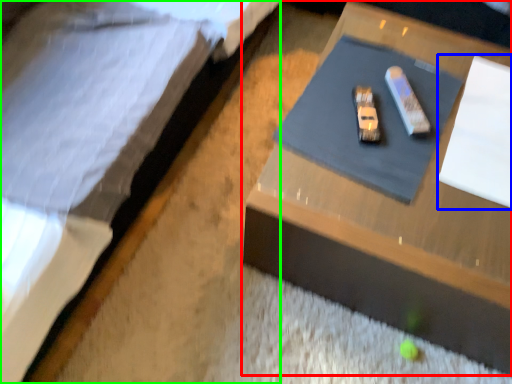
Question: Which is farther away from table (highlighted by a red box)? notepad (highlighted by a blue box) or bed (highlighted by a green box)?

Choices:
 (A) notepad
 (B) bed

Answer: (B)